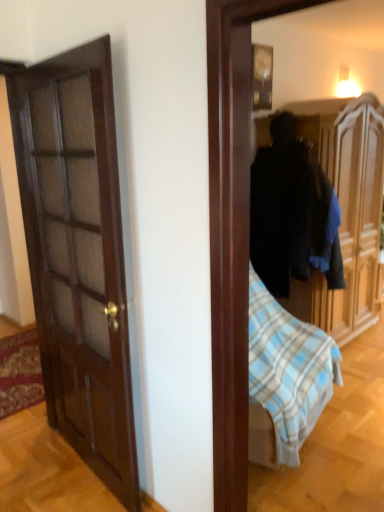
Identify the location of wooden wardrobe at center. This screenshot has width=384, height=512. (346, 209).

Describe the element at coordinates (346, 209) in the screenshot. I see `wooden wardrobe at center` at that location.

What do you see at coordinates (262, 76) in the screenshot? I see `wooden clock at upper center` at bounding box center [262, 76].

What is the approximate width of wooden clock at upper center?

It is 5.25 inches.

What are the coordinates of `wooden clock at upper center` in the screenshot? It's located at point(262,76).

The height and width of the screenshot is (512, 384). I want to click on wooden wardrobe at center, so click(346, 209).

Which is more to the right, wooden clock at upper center or wooden wardrobe at center?

Positioned to the right is wooden wardrobe at center.

Does wooden clock at upper center come behind wooden wardrobe at center?

Yes, it is behind wooden wardrobe at center.

Based on the photo, which is closer, (262, 54) or (339, 334)?

Clearly, point (262, 54) is closer to the camera than point (339, 334).

From the image's perspective, is wooden clock at upper center located beneath wooden wardrobe at center?

Actually, wooden clock at upper center appears above wooden wardrobe at center in the image.

From a real-world perspective, is wooden clock at upper center on top of wooden wardrobe at center?

Yes.

In the scene shown: Considering the sizes of wooden clock at upper center and wooden wardrobe at center in the image, is wooden clock at upper center wider or thinner than wooden wardrobe at center?

In the image, wooden clock at upper center appears to be more narrow than wooden wardrobe at center.

Considering the relative sizes of wooden clock at upper center and wooden wardrobe at center in the image provided, is wooden clock at upper center shorter than wooden wardrobe at center?

Indeed, wooden clock at upper center has a lesser height compared to wooden wardrobe at center.

Considering the sizes of objects wooden clock at upper center and wooden wardrobe at center in the image provided, who is smaller, wooden clock at upper center or wooden wardrobe at center?

Smaller between the two is wooden clock at upper center.

Is wooden wardrobe at center completely or partially inside wooden clock at upper center?

No, wooden wardrobe at center is located outside of wooden clock at upper center.

In the scene shown: Is wooden clock at upper center beside wooden wardrobe at center?

No, wooden clock at upper center is not with wooden wardrobe at center.

Could you tell me if wooden clock at upper center is turned towards wooden wardrobe at center?

No, wooden clock at upper center is not oriented towards wooden wardrobe at center.

What's the angular difference between wooden clock at upper center and wooden wardrobe at center's facing directions?

The angular difference between wooden clock at upper center and wooden wardrobe at center is 0.0017 degrees.

You are a GUI agent. You are given a task and a screenshot of the screen. Output one action in this format:
    pyautogui.click(x=<x>, y=<y>)
    Task: Click on the picture frame that is above the wooden wardrobe at center (from a real-world perspective)
    This screenshot has width=384, height=512.
    Given the screenshot: What is the action you would take?
    pyautogui.click(x=262, y=76)

Can you confirm if wooden wardrobe at center is positioned to the left of wooden clock at upper center?

Incorrect, wooden wardrobe at center is not on the left side of wooden clock at upper center.

Is the depth of wooden wardrobe at center less than that of wooden clock at upper center?

That is True.

Between point (375, 264) and point (266, 92), which one is positioned in front?

The point (266, 92) is closer.

From the image's perspective, would you say wooden wardrobe at center is shown under wooden clock at upper center?

Yes, from the image's perspective, wooden wardrobe at center is below wooden clock at upper center.

From a real-world perspective, is wooden wardrobe at center located beneath wooden clock at upper center?

Yes, from a real-world perspective, wooden wardrobe at center is beneath wooden clock at upper center.

Can you confirm if wooden wardrobe at center is thinner than wooden clock at upper center?

Incorrect, the width of wooden wardrobe at center is not less than that of wooden clock at upper center.

Considering the sizes of objects wooden wardrobe at center and wooden clock at upper center in the image provided, who is shorter, wooden wardrobe at center or wooden clock at upper center?

With less height is wooden clock at upper center.

Considering the sizes of wooden wardrobe at center and wooden clock at upper center in the image, is wooden wardrobe at center bigger or smaller than wooden clock at upper center?

wooden wardrobe at center is bigger than wooden clock at upper center.

Is wooden clock at upper center completely or partially inside wooden wardrobe at center?

No.

Is wooden wardrobe at center with wooden clock at upper center?

No, wooden wardrobe at center is not with wooden clock at upper center.

Is wooden wardrobe at center looking in the opposite direction of wooden clock at upper center?

wooden wardrobe at center is not turned away from wooden clock at upper center.

Find the location of a particular element. This screenshot has width=384, height=512. cabinetry directly beneath the wooden clock at upper center (from a real-world perspective) is located at coordinates (346, 209).

This screenshot has width=384, height=512. I want to click on picture frame lying behind the wooden wardrobe at center, so click(262, 76).

Locate an element on the screen. The image size is (384, 512). picture frame that appears above the wooden wardrobe at center (from the image's perspective) is located at coordinates (262, 76).